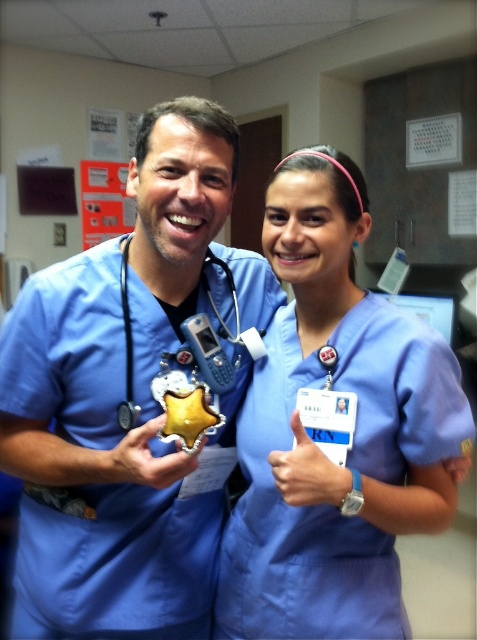
Which is in front, point (27, 604) or point (239, 324)?

Positioned in front is point (27, 604).

Which is in front, point (153, 337) or point (186, 330)?

Positioned in front is point (153, 337).

This screenshot has width=477, height=640. Find the location of `matte blue scrubs at center`. matte blue scrubs at center is located at coordinates (134, 396).

Does matte blue stethoscope at left lie behind gold metallic badge at center?

Answer: No.

Who is positioned more to the left, matte blue stethoscope at left or gold metallic badge at center?

From the viewer's perspective, gold metallic badge at center appears more on the left side.

Between point (199, 401) and point (134, 452), which one is positioned behind?

The point (199, 401) is more distant.

The width and height of the screenshot is (477, 640). Find the location of `matte blue stethoscope at left`. matte blue stethoscope at left is located at coordinates (194, 385).

Who is higher up, blue fabric hand at center or gold metallic badge at center?

gold metallic badge at center is above.

Is blue fabric hand at center positioned behind gold metallic badge at center?

Yes, it is behind gold metallic badge at center.

Between point (321, 499) and point (163, 422), which one is positioned behind?

The point (321, 499) is more distant.

At what (x,y) coordinates should I click in order to perform the action: click on blue fabric hand at center. Please return your answer as a coordinate pair (x, y). Looking at the image, I should click on (308, 472).